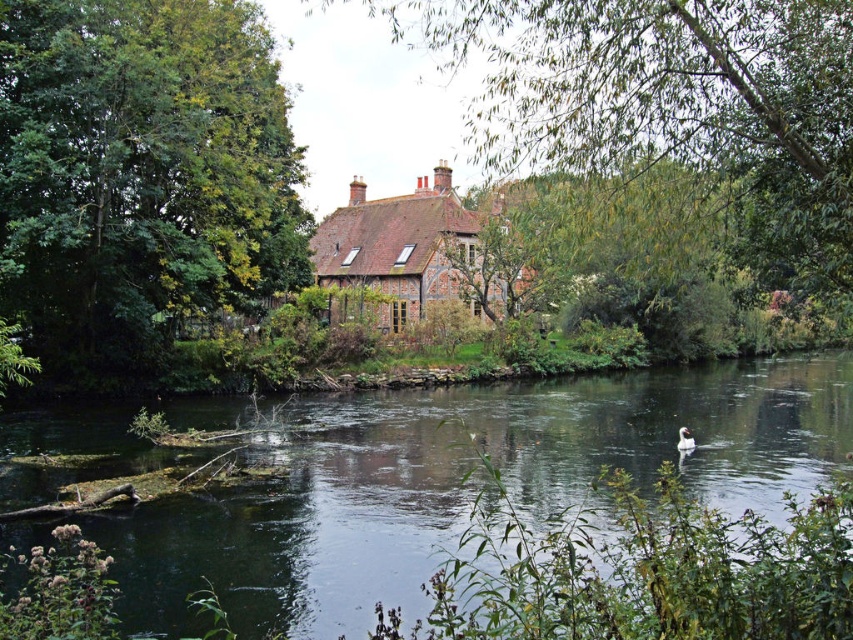
Does green leafy tree at left have a lesser height compared to brown brick cottage at center?

No.

Can you confirm if green leafy tree at left is positioned below brown brick cottage at center?

Yes.

The image size is (853, 640). What are the coordinates of `green leafy tree at left` in the screenshot? It's located at (140, 177).

This screenshot has width=853, height=640. What are the coordinates of `green leafy tree at left` in the screenshot? It's located at (140, 177).

Between green leafy tree at left and green leafy tree at center, which one is positioned lower?

green leafy tree at left

Between green leafy tree at left and green leafy tree at center, which one appears on the right side from the viewer's perspective?

Positioned to the right is green leafy tree at center.

Who is more distant from viewer, (x=71, y=323) or (x=547, y=106)?

Point (x=71, y=323)

Locate an element on the screen. This screenshot has height=640, width=853. green leafy tree at left is located at coordinates (140, 177).

Consider the image. Is greenish water at center taller than green leafy tree at left?

Incorrect, greenish water at center's height is not larger of green leafy tree at left's.

The width and height of the screenshot is (853, 640). I want to click on greenish water at center, so click(x=462, y=483).

Where is `greenish water at center`? Image resolution: width=853 pixels, height=640 pixels. greenish water at center is located at coordinates (462, 483).